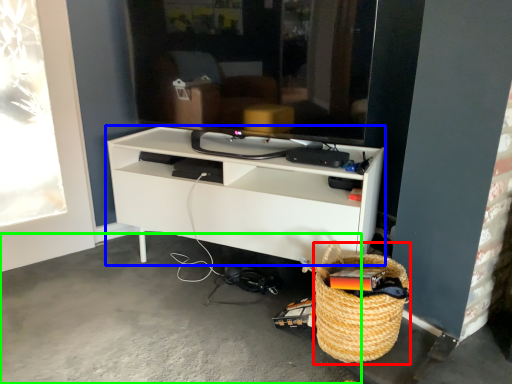
Question: Which object is positioned farthest from basket (highlighted by a red box)? Select from shelf (highlighted by a blue box) and concrete (highlighted by a green box).

Choices:
 (A) shelf
 (B) concrete

Answer: (B)